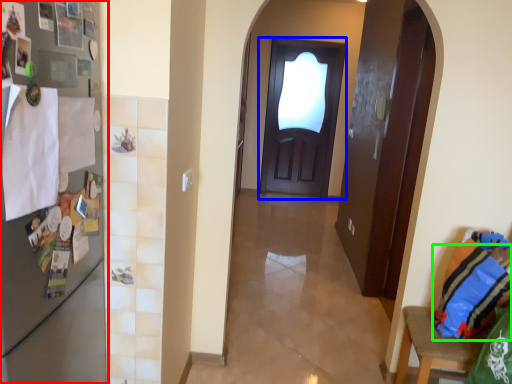
Question: Which is nearer to the fridge (highlighted by a red box)? door (highlighted by a blue box) or pillow (highlighted by a green box).

Choices:
 (A) door
 (B) pillow

Answer: (B)